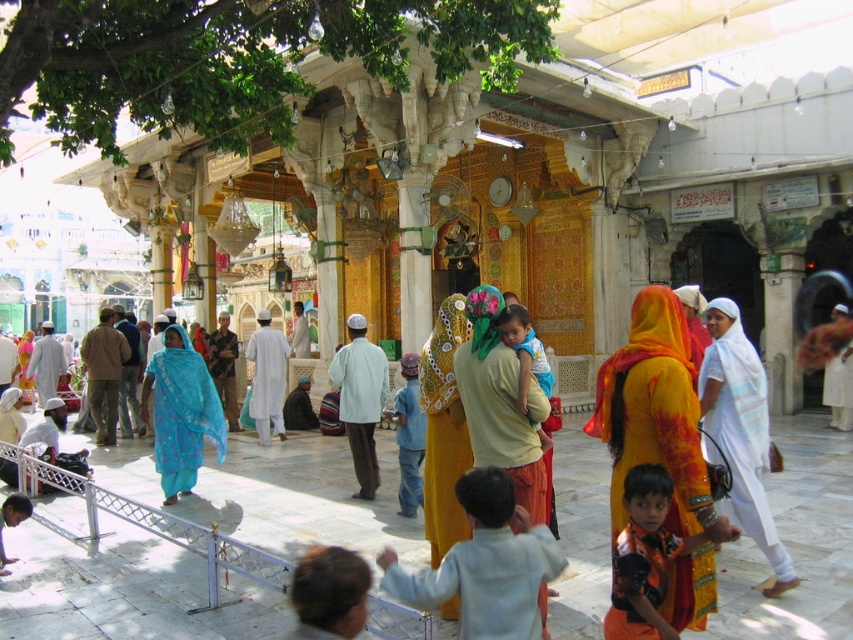
Which is more to the left, white matte shirt at center or matte blue robe at center?

From the viewer's perspective, matte blue robe at center appears more on the left side.

Who is lower down, white matte shirt at center or matte blue robe at center?

Positioned lower is white matte shirt at center.

Who is more forward, (364, 337) or (45, 362)?

Point (364, 337) is in front.

Locate an element on the screen. Image resolution: width=853 pixels, height=640 pixels. white matte shirt at center is located at coordinates (360, 400).

Locate an element on the screen. This screenshot has width=853, height=640. white cotton robe at lower right is located at coordinates (741, 429).

Who is shorter, white cotton robe at lower right or blue printed fabric at center?

With less height is blue printed fabric at center.

Where is `white cotton robe at lower right`? white cotton robe at lower right is located at coordinates (741, 429).

Find the location of a particular element. white cotton robe at lower right is located at coordinates [741, 429].

What do you see at coordinates (654, 413) in the screenshot? I see `orange printed sari at center` at bounding box center [654, 413].

Is orange printed sari at center taller than white cotton robe at lower right?

Correct, orange printed sari at center is much taller as white cotton robe at lower right.

Is point (711, 596) closer to camera compared to point (720, 376)?

Yes.

Where is `orange printed sari at center`? orange printed sari at center is located at coordinates pyautogui.click(x=654, y=413).